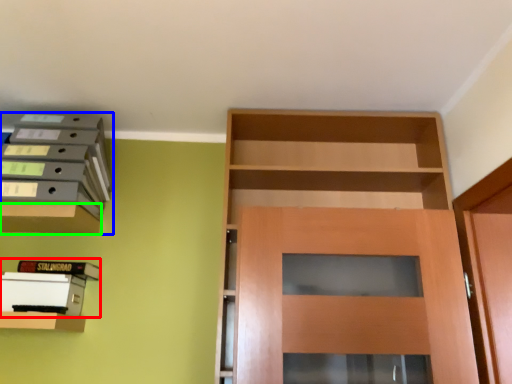
Question: Which object is the closest to the book (highlighted by a red box)? Choose among these: shelf (highlighted by a blue box) or cabinetry (highlighted by a green box).

Choices:
 (A) shelf
 (B) cabinetry

Answer: (B)